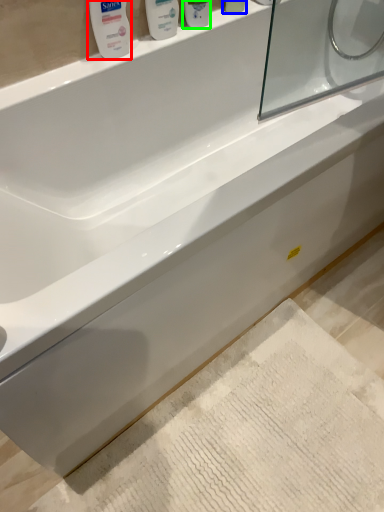
Question: Which object is positioned closest to mouthwash (highlighted by a red box)? Select from mouthwash (highlighted by a blue box) and mouthwash (highlighted by a green box).

Choices:
 (A) mouthwash
 (B) mouthwash

Answer: (B)